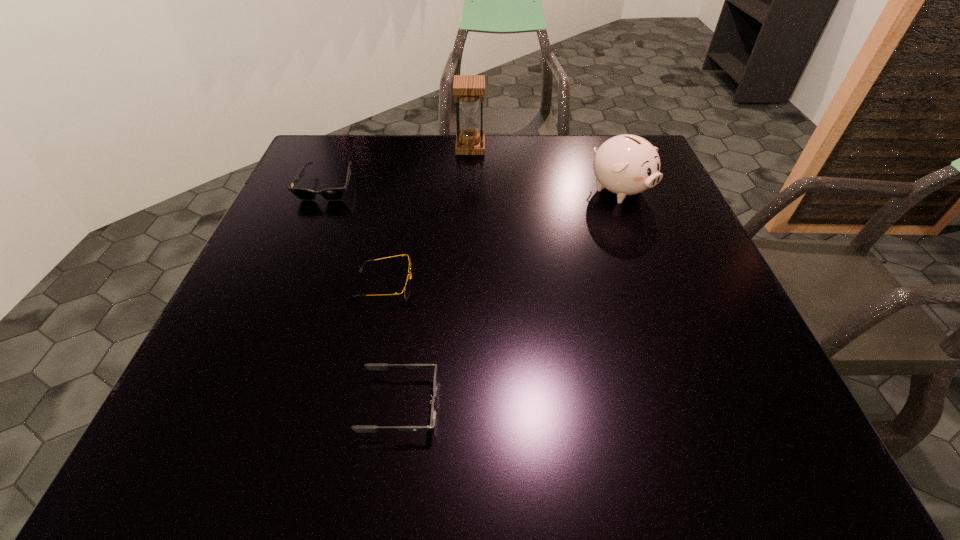
Find the location of `free point that satisfies the following two spatial constraints: 1. on the front-facing side of the piggy bank; 2. on the left side of the leftmost object`. free point that satisfies the following two spatial constraints: 1. on the front-facing side of the piggy bank; 2. on the left side of the leftmost object is located at coordinates (325, 191).